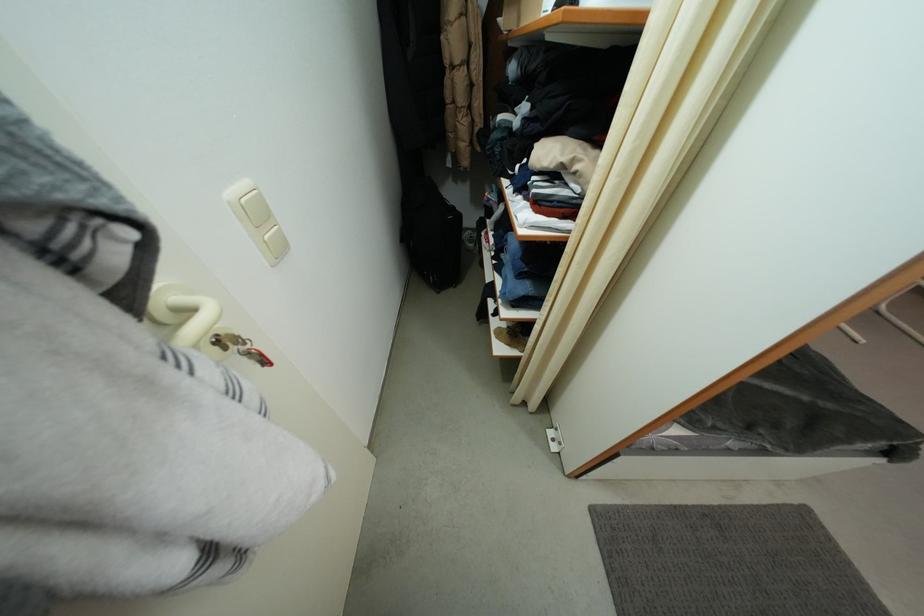
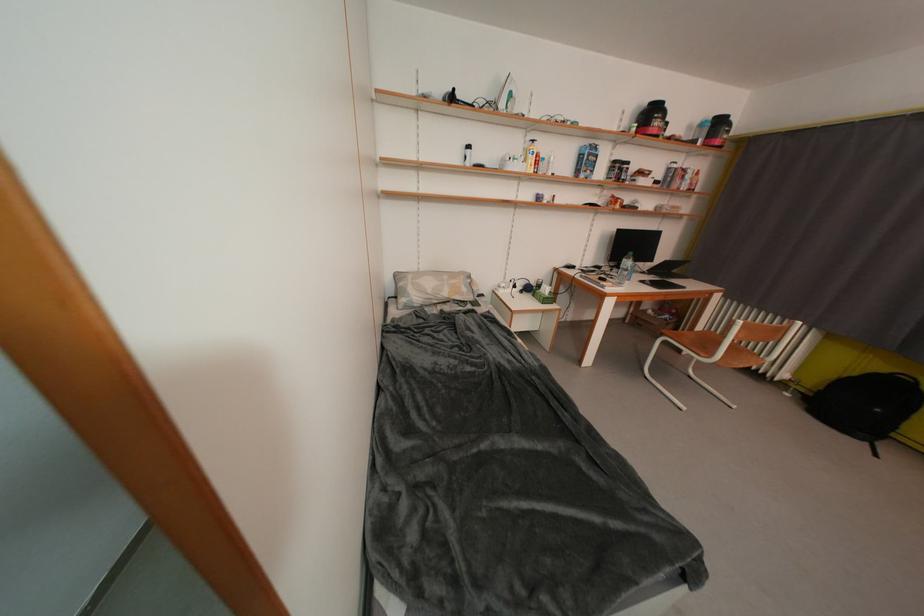
Question: In a continuous first-person perspective shot, in which direction is the camera moving?

Choices:
 (A) Left
 (B) Right
 (C) Forward
 (D) Backward

Answer: (B)